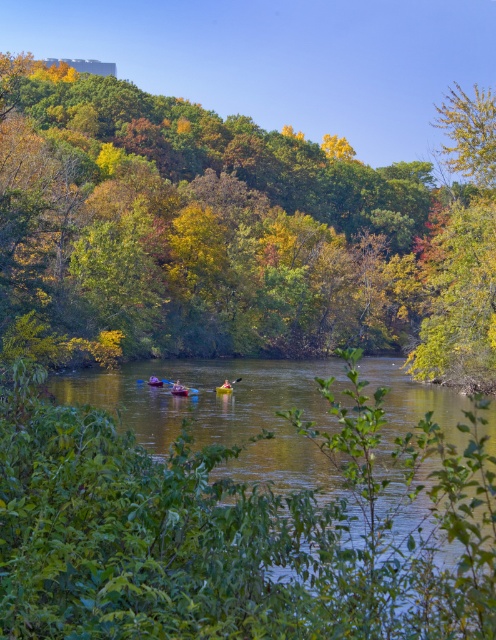
Question: Which of the following is the farthest from the observer?

Choices:
 (A) green leafy tree at center
 (B) wooden paddle at center
 (C) green smooth water at center

Answer: (B)

Question: Which object appears closest to the camera in this image?

Choices:
 (A) wooden paddle at center
 (B) green smooth water at center
 (C) green leafy tree at center

Answer: (B)

Question: Which object is positioned farthest from the wooden paddle at center?

Choices:
 (A) green leafy tree at center
 (B) green smooth water at center

Answer: (A)

Question: Is green leafy tree at center positioned in front of green smooth water at center?

Choices:
 (A) no
 (B) yes

Answer: (A)

Question: Is the position of green smooth water at center less distant than that of wooden paddle at center?

Choices:
 (A) yes
 (B) no

Answer: (A)

Question: Is green leafy tree at center bigger than wooden paddle at center?

Choices:
 (A) no
 (B) yes

Answer: (B)